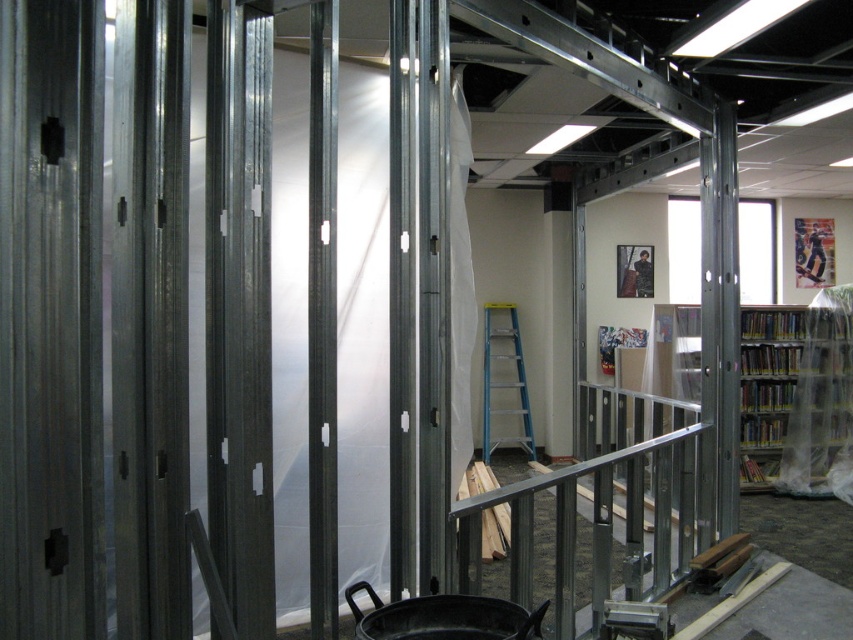
You are a construction worker who needs to move a large equipment that is 1.2 meters wide. You see the metallic silver rail at center and the blue aluminum ladder at center. Can the equipment pass through the space between them?

The metallic silver rail at center might be wider than the blue aluminum ladder at center, so the space between them may not be wide enough for the equipment that is 1.2 meters wide. Check the exact width before moving the equipment.

You are an interior designer trying to place a new bookshelf in the room. You have the clear plastic bookshelf at right and the blue aluminum ladder at center. Which object is wider?

The clear plastic bookshelf at right might be wider than blue aluminum ladder at center according to the description.

In the scene shown: You are a construction worker needing to reach the top of the blue aluminum ladder at center to secure the clear plastic bookshelf at right. Which object should you climb first?

You should climb the blue aluminum ladder at center first to reach the height needed to secure the clear plastic bookshelf at right.